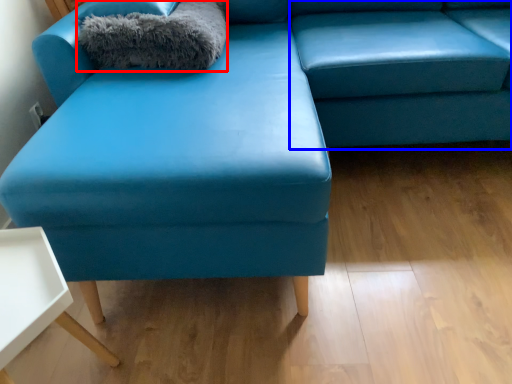
Question: Which object is closer to the camera taking this photo, blanket (highlighted by a red box) or swivel chair (highlighted by a blue box)?

Choices:
 (A) blanket
 (B) swivel chair

Answer: (B)